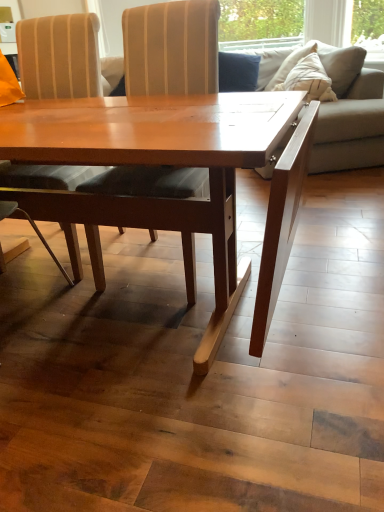
Where is `free spot below wooden striped chair at center, arranged as the 1th chair when viewed from the right (from a real-world perspective)`? The width and height of the screenshot is (384, 512). free spot below wooden striped chair at center, arranged as the 1th chair when viewed from the right (from a real-world perspective) is located at coordinates (159, 267).